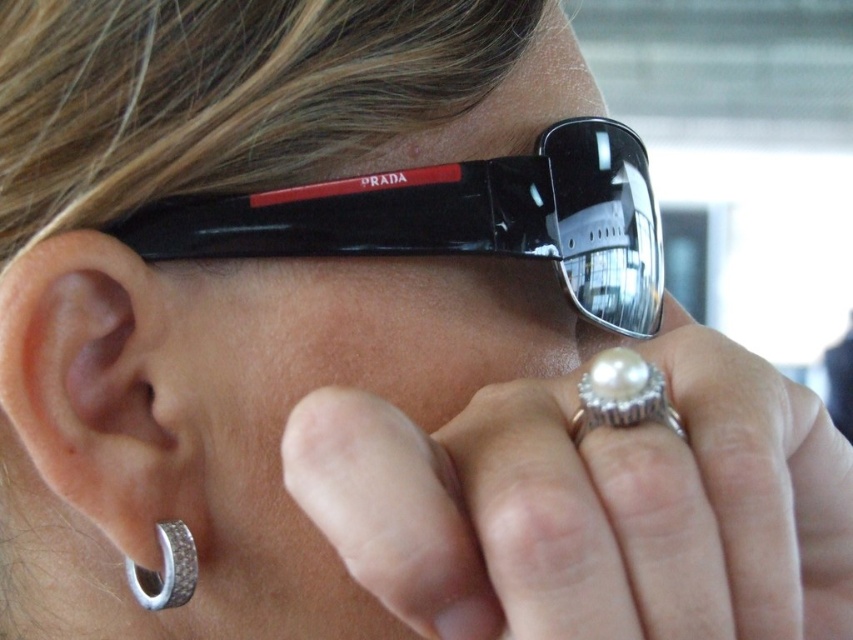
You are a jeweler examining the image of the person. You need to determine if the pearlsmoothring at right can be placed on the right side of the black plastic sunglasses at upper center without overlapping. Can it fit?

The black plastic sunglasses at upper center might be wider than pearlsmoothring at right, so there is a possibility that placing the pearlsmoothring at right on the right side of the black plastic sunglasses at upper center could cause overlapping. Further measurement is needed to confirm.